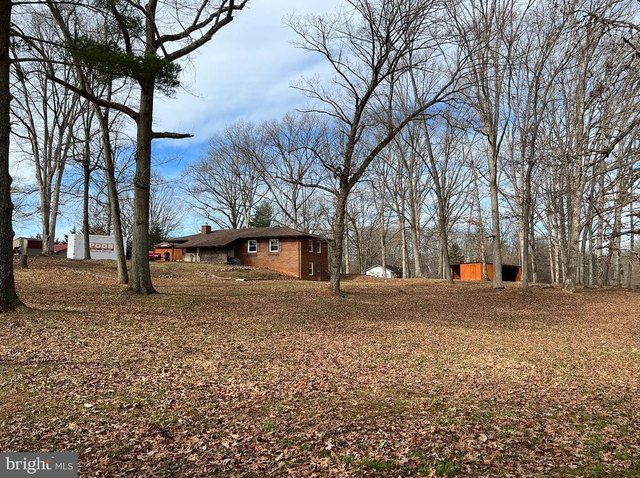
Locate an element on the screen. This screenshot has width=640, height=478. garage is located at coordinates (163, 251).